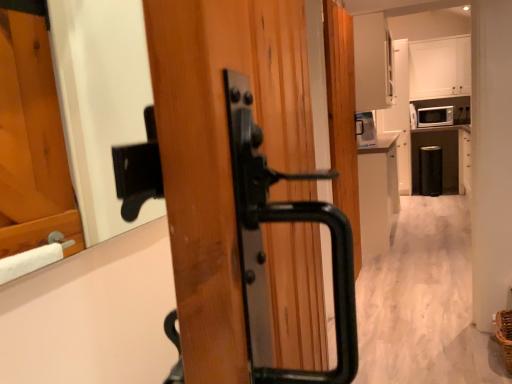
Question: Is white glossy cabinet at center, acting as the 1th cabinetry starting from the front, at the left side of white matte cabinet at upper center, which appears as the 1th cabinetry when viewed from the top?

Choices:
 (A) no
 (B) yes

Answer: (B)

Question: Does white glossy cabinet at center, placed as the second cabinetry when sorted from right to left, contain white matte cabinet at upper center, the 2th cabinetry viewed from the front?

Choices:
 (A) no
 (B) yes

Answer: (A)

Question: Are white glossy cabinet at center, acting as the 1th cabinetry starting from the front, and white matte cabinet at upper center, the first cabinetry when ordered from right to left, beside each other?

Choices:
 (A) no
 (B) yes

Answer: (A)

Question: Considering the relative sizes of white glossy cabinet at center, placed as the 1th cabinetry when sorted from bottom to top, and white matte cabinet at upper center, which is the 2th cabinetry from left to right, in the image provided, is white glossy cabinet at center, placed as the 1th cabinetry when sorted from bottom to top, wider than white matte cabinet at upper center, which is the 2th cabinetry from left to right,?

Choices:
 (A) no
 (B) yes

Answer: (A)

Question: Is white glossy cabinet at center, the 1th cabinetry when ordered from left to right, not close to white matte cabinet at upper center, which is the 2th cabinetry from left to right?

Choices:
 (A) no
 (B) yes

Answer: (B)

Question: Can we say white glossy cabinet at center, the second cabinetry from the top, lies outside white matte cabinet at upper center, which appears as the 1th cabinetry when viewed from the top?

Choices:
 (A) yes
 (B) no

Answer: (A)

Question: Considering the relative sizes of matte white microwave at upper right and white matte cabinet at upper center, the 2th cabinetry viewed from the front, in the image provided, is matte white microwave at upper right thinner than white matte cabinet at upper center, the 2th cabinetry viewed from the front,?

Choices:
 (A) no
 (B) yes

Answer: (A)

Question: From the image's perspective, is matte white microwave at upper right on top of white matte cabinet at upper center, which is the 2th cabinetry from left to right?

Choices:
 (A) yes
 (B) no

Answer: (B)

Question: Would you say white matte cabinet at upper center, the second cabinetry when ordered from bottom to top, is part of matte white microwave at upper right's contents?

Choices:
 (A) yes
 (B) no

Answer: (B)

Question: Does matte white microwave at upper right have a larger size compared to white matte cabinet at upper center, the 1th cabinetry when ordered from back to front?

Choices:
 (A) no
 (B) yes

Answer: (A)

Question: Does matte white microwave at upper right lie in front of white matte cabinet at upper center, which is the 2th cabinetry from left to right?

Choices:
 (A) no
 (B) yes

Answer: (A)

Question: Could you tell me if matte white microwave at upper right is facing white matte cabinet at upper center, which is the 2th cabinetry from left to right?

Choices:
 (A) no
 (B) yes

Answer: (A)

Question: Does matte white microwave at upper right have a lesser width compared to white glossy cabinet at center, the second cabinetry from the top?

Choices:
 (A) no
 (B) yes

Answer: (A)